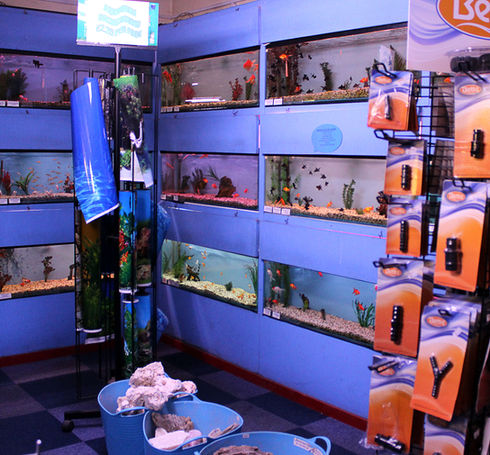
You are a GUI agent. You are given a task and a screenshot of the screen. Output one action in this format:
    pyautogui.click(x=<x>, y=<y>)
    Task: Click on the tile floor
    
    Given the screenshot: What is the action you would take?
    pyautogui.click(x=43, y=404)